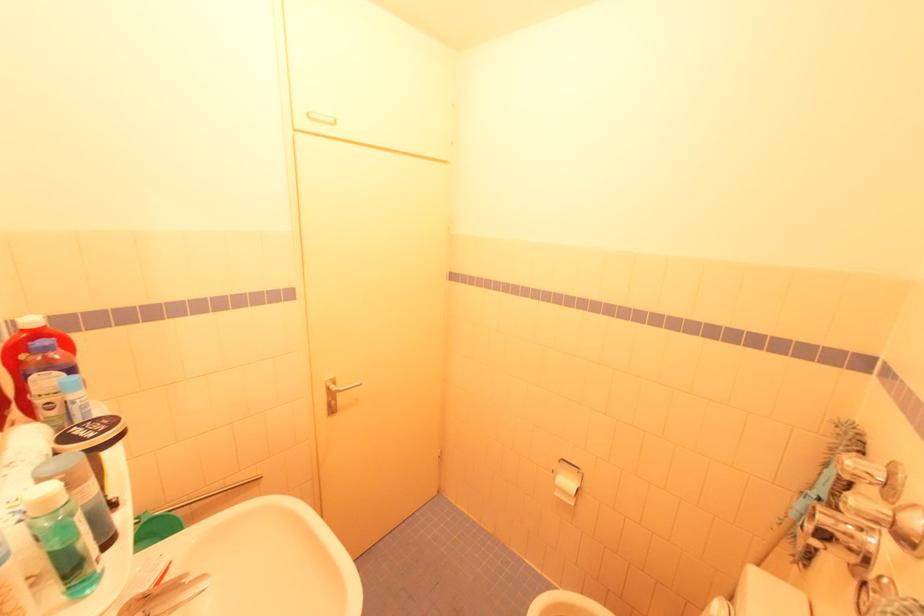
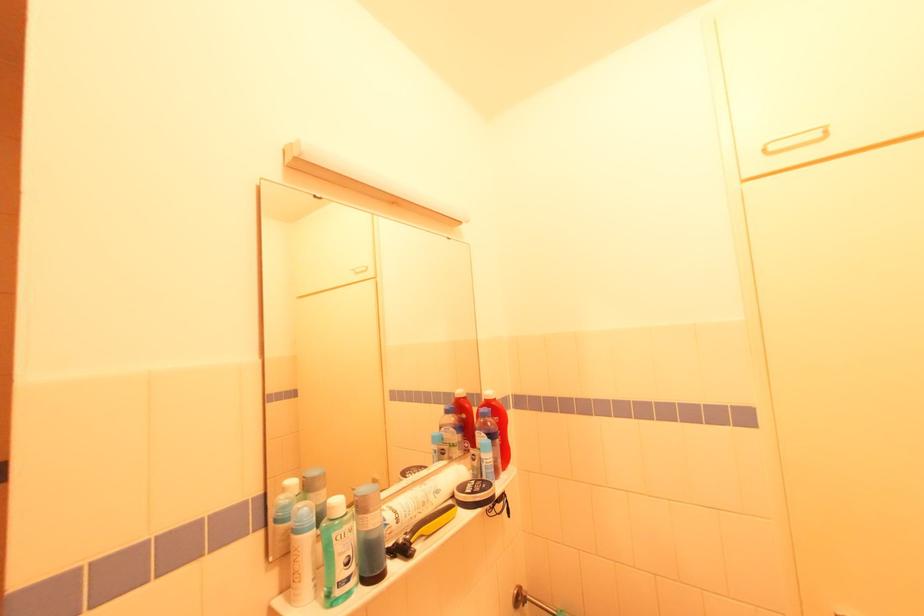
Locate, in the second image, the point that corresponds to (313,116) in the first image.

(773, 148)